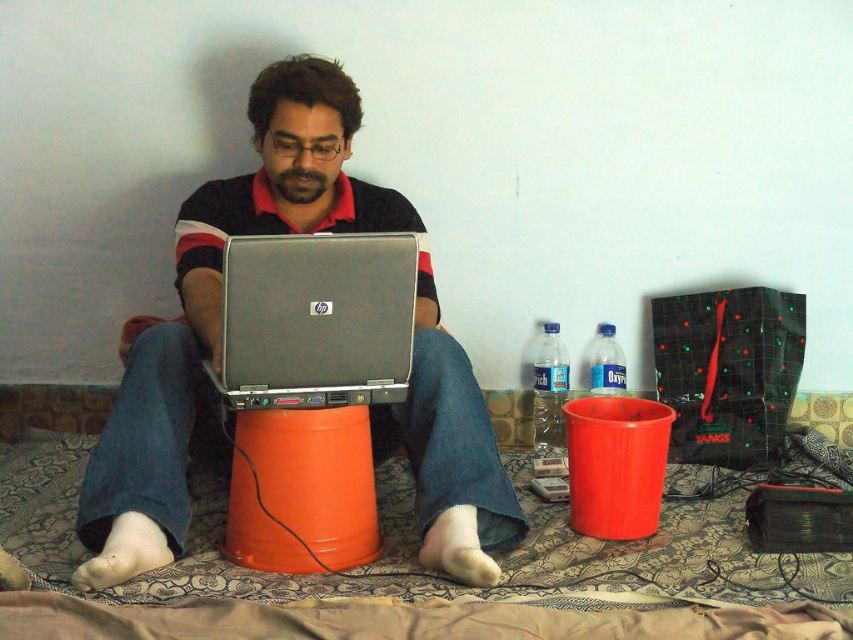
Question: Observing the image, what is the correct spatial positioning of matte black laptop at center in reference to clear plastic bottle at center right?

Choices:
 (A) below
 (B) above

Answer: (B)

Question: Which point is farther to the camera?

Choices:
 (A) silver metallic laptop at center
 (B) transparent plastic bottle at right
 (C) clear plastic bottle at center right

Answer: (C)

Question: Which of the following is the farthest from the observer?

Choices:
 (A) clear plastic bottle at center right
 (B) matte black laptop at center
 (C) transparent plastic bottle at right

Answer: (A)

Question: Can you confirm if clear plastic bottle at center right is positioned below transparent plastic bottle at right?

Choices:
 (A) no
 (B) yes

Answer: (B)

Question: Where is silver metallic laptop at center located in relation to transparent plastic bottle at right in the image?

Choices:
 (A) below
 (B) above

Answer: (B)

Question: Estimate the real-world distances between objects in this image. Which object is closer to the silver metallic laptop at center?

Choices:
 (A) transparent plastic bottle at right
 (B) clear plastic bottle at center right

Answer: (B)